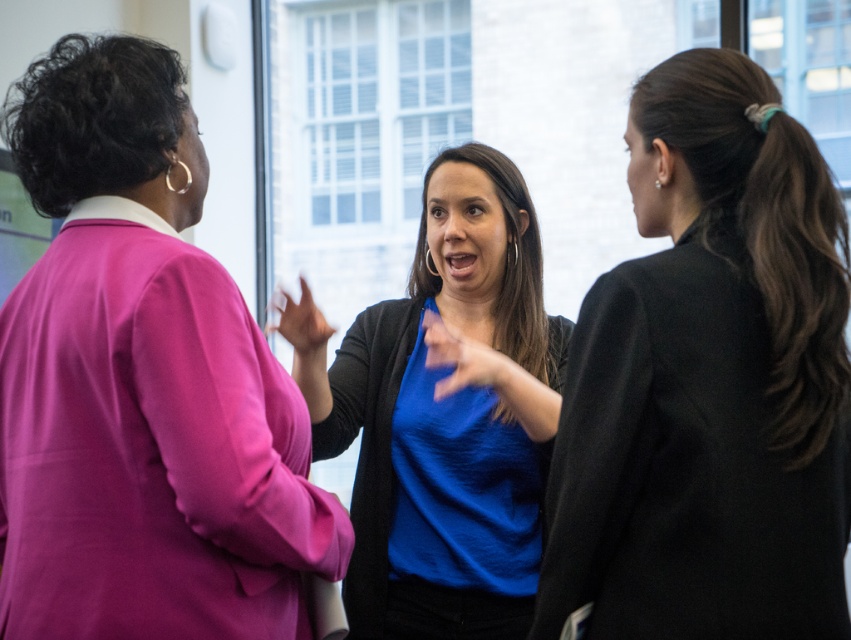
You are an assistant organizing a meeting in the conference room. You need to seat two attendees based on their blazer sizes. The person wearing the matte pink blazer at left requires a wider chair than the one wearing the black matte blazer at right. Which attendee should get the wider chair?

The matte pink blazer at left requires a wider chair because its width is larger than the black matte blazer at right.

You are standing in the office scene described. You need to locate the matte pink blazer at left. Where exactly is it positioned in terms of coordinates?

The matte pink blazer at left is positioned at coordinates point (141, 384).